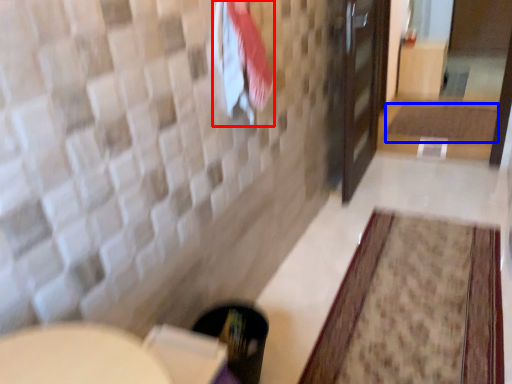
Question: Which point is further to the camera, beach towel (highlighted by a red box) or bath mat (highlighted by a blue box)?

Choices:
 (A) beach towel
 (B) bath mat

Answer: (B)